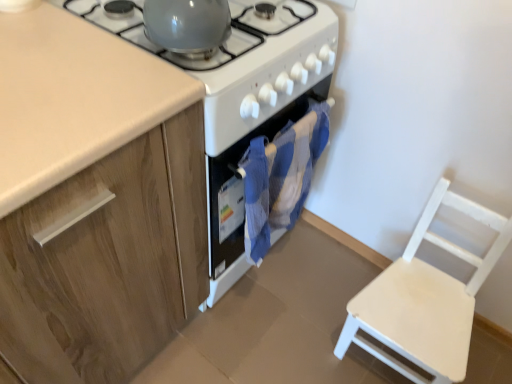
At what (x,y) coordinates should I click in order to perform the action: click on wooden cabinet at left. Please return your answer as a coordinate pair (x, y). Looking at the image, I should click on pyautogui.click(x=95, y=200).

In order to click on white wooden chair at lower right in this screenshot , I will do `click(425, 299)`.

Can you tell me how much white glossy stove at center and glossy ceramic kettle at upper center, acting as the first gas stove starting from the right, differ in facing direction?

They differ by 179 degrees in their facing directions.

The width and height of the screenshot is (512, 384). I want to click on appliance below the glossy ceramic kettle at upper center, acting as the first gas stove starting from the right (from the image's perspective), so click(x=242, y=99).

Who is more distant, white glossy stove at center or glossy ceramic kettle at upper center, acting as the first gas stove starting from the right?

Positioned behind is white glossy stove at center.

Is white glossy stove at center placed right next to glossy ceramic kettle at upper center, acting as the first gas stove starting from the right?

No, white glossy stove at center is not next to glossy ceramic kettle at upper center, acting as the first gas stove starting from the right.

Based on the photo, is white wooden chair at lower right at the back of white glossy gas stove at center, which ranks as the 2th gas stove in right-to-left order?

white glossy gas stove at center, which ranks as the 2th gas stove in right-to-left order, is not turned away from white wooden chair at lower right.

Based on the photo, considering the relative sizes of white glossy gas stove at center, the first gas stove positioned from the left, and white wooden chair at lower right in the image provided, is white glossy gas stove at center, the first gas stove positioned from the left, bigger than white wooden chair at lower right?

Yes.

Considering the sizes of white glossy gas stove at center, which ranks as the 2th gas stove in right-to-left order, and white wooden chair at lower right in the image, is white glossy gas stove at center, which ranks as the 2th gas stove in right-to-left order, taller or shorter than white wooden chair at lower right?

white glossy gas stove at center, which ranks as the 2th gas stove in right-to-left order, is shorter than white wooden chair at lower right.

From a real-world perspective, is white glossy gas stove at center, the first gas stove positioned from the left, positioned over white wooden chair at lower right based on gravity?

Yes, from a real-world perspective, white glossy gas stove at center, the first gas stove positioned from the left, is on top of white wooden chair at lower right.

Is white glossy stove at center smaller than white glossy gas stove at center, which ranks as the 2th gas stove in right-to-left order?

Incorrect, white glossy stove at center is not smaller in size than white glossy gas stove at center, which ranks as the 2th gas stove in right-to-left order.

Is white glossy stove at center far from white glossy gas stove at center, which ranks as the 2th gas stove in right-to-left order?

white glossy stove at center is near white glossy gas stove at center, which ranks as the 2th gas stove in right-to-left order, not far away.

Is white glossy stove at center surrounding white glossy gas stove at center, the first gas stove positioned from the left?

No, white glossy gas stove at center, the first gas stove positioned from the left, is not surrounded by white glossy stove at center.

Considering the relative positions of white glossy stove at center and white glossy gas stove at center, which ranks as the 2th gas stove in right-to-left order, in the image provided, is white glossy stove at center behind white glossy gas stove at center, which ranks as the 2th gas stove in right-to-left order,?

Yes, the depth of white glossy stove at center is greater than that of white glossy gas stove at center, which ranks as the 2th gas stove in right-to-left order.

From a real-world perspective, is glossy ceramic kettle at upper center, acting as the first gas stove starting from the right, on top of blue fabric oven at center?

Yes.

Looking at this image, which of these two, glossy ceramic kettle at upper center, the 2th gas stove viewed from the left, or blue fabric oven at center, is bigger?

blue fabric oven at center is bigger.

Does glossy ceramic kettle at upper center, acting as the first gas stove starting from the right, have a lesser width compared to blue fabric oven at center?

In fact, glossy ceramic kettle at upper center, acting as the first gas stove starting from the right, might be wider than blue fabric oven at center.

Could you tell me if wooden cabinet at left is turned towards white glossy stove at center?

No, wooden cabinet at left is not turned towards white glossy stove at center.

Does wooden cabinet at left have a smaller size compared to white glossy stove at center?

No, wooden cabinet at left is not smaller than white glossy stove at center.

From a real-world perspective, between wooden cabinet at left and white glossy stove at center, who is vertically lower?

white glossy stove at center, from a real-world perspective.

Locate an element on the screen. appliance located above the wooden cabinet at left (from the image's perspective) is located at coordinates (242, 99).

Could you tell me if glossy ceramic kettle at upper center, the 2th gas stove viewed from the left, is facing wooden cabinet at left?

No.

Consider the image. Considering the sizes of glossy ceramic kettle at upper center, the 2th gas stove viewed from the left, and wooden cabinet at left in the image, is glossy ceramic kettle at upper center, the 2th gas stove viewed from the left, bigger or smaller than wooden cabinet at left?

In the image, glossy ceramic kettle at upper center, the 2th gas stove viewed from the left, appears to be smaller than wooden cabinet at left.

This screenshot has width=512, height=384. I want to click on gas stove that is the 1st one when counting upward from the wooden cabinet at left (from the image's perspective), so click(x=220, y=47).

Between wooden cabinet at left and blue fabric oven at center, which one has more height?

wooden cabinet at left.

Based on the photo, is wooden cabinet at left inside or outside of blue fabric oven at center?

wooden cabinet at left cannot be found inside blue fabric oven at center.

Between wooden cabinet at left and blue fabric oven at center, which one appears on the right side from the viewer's perspective?

From the viewer's perspective, blue fabric oven at center appears more on the right side.

How far apart are wooden cabinet at left and blue fabric oven at center?

wooden cabinet at left is 10.63 inches from blue fabric oven at center.

Find the location of a particular element. This screenshot has width=512, height=384. appliance located below the glossy ceramic kettle at upper center, acting as the first gas stove starting from the right (from the image's perspective) is located at coordinates (242, 99).

Locate an element on the screen. This screenshot has width=512, height=384. chair behind the white glossy gas stove at center, the first gas stove positioned from the left is located at coordinates (425, 299).

From the image, which object appears to be farther from white glossy stove at center, white glossy gas stove at center, which ranks as the 2th gas stove in right-to-left order, or wooden cabinet at left?

Based on the image, wooden cabinet at left appears to be further to white glossy stove at center.

Which object lies further to the anchor point white wooden chair at lower right, white glossy gas stove at center, which ranks as the 2th gas stove in right-to-left order, or blue fabric oven at center?

The object further to white wooden chair at lower right is white glossy gas stove at center, which ranks as the 2th gas stove in right-to-left order.

Looking at the image, which one is located further to wooden cabinet at left, white glossy stove at center or glossy ceramic kettle at upper center, acting as the first gas stove starting from the right?

glossy ceramic kettle at upper center, acting as the first gas stove starting from the right.

Consider the image. From the image, which object appears to be farther from white glossy gas stove at center, the first gas stove positioned from the left, blue fabric oven at center or white glossy stove at center?

Among the two, blue fabric oven at center is located further to white glossy gas stove at center, the first gas stove positioned from the left.

Looking at the image, which one is located closer to glossy ceramic kettle at upper center, acting as the first gas stove starting from the right, wooden cabinet at left or white wooden chair at lower right?

wooden cabinet at left is positioned closer to the anchor glossy ceramic kettle at upper center, acting as the first gas stove starting from the right.

Based on their spatial positions, is glossy ceramic kettle at upper center, acting as the first gas stove starting from the right, or white glossy gas stove at center, which ranks as the 2th gas stove in right-to-left order, further from white glossy stove at center?

Among the two, glossy ceramic kettle at upper center, acting as the first gas stove starting from the right, is located further to white glossy stove at center.

Estimate the real-world distances between objects in this image. Which object is closer to white glossy gas stove at center, which ranks as the 2th gas stove in right-to-left order, blue fabric oven at center or white wooden chair at lower right?

Based on the image, blue fabric oven at center appears to be nearer to white glossy gas stove at center, which ranks as the 2th gas stove in right-to-left order.

From the image, which object appears to be nearer to glossy ceramic kettle at upper center, acting as the first gas stove starting from the right, blue fabric oven at center or white wooden chair at lower right?

Among the two, blue fabric oven at center is located nearer to glossy ceramic kettle at upper center, acting as the first gas stove starting from the right.

You are a GUI agent. You are given a task and a screenshot of the screen. Output one action in this format:
    pyautogui.click(x=<x>, y=<y>)
    Task: Click on the oven between white glossy gas stove at center, which ranks as the 2th gas stove in right-to-left order, and white wooden chair at lower right from top to bottom
    
    Given the screenshot: What is the action you would take?
    pyautogui.click(x=241, y=195)

Identify the location of appliance between wooden cabinet at left and white wooden chair at lower right. The height and width of the screenshot is (384, 512). (242, 99).

This screenshot has width=512, height=384. I want to click on gas stove between white glossy gas stove at center, which ranks as the 2th gas stove in right-to-left order, and white glossy stove at center from top to bottom, so click(220, 47).

This screenshot has width=512, height=384. Find the location of `oven between wooden cabinet at left and white wooden chair at lower right from left to right`. oven between wooden cabinet at left and white wooden chair at lower right from left to right is located at coordinates (241, 195).